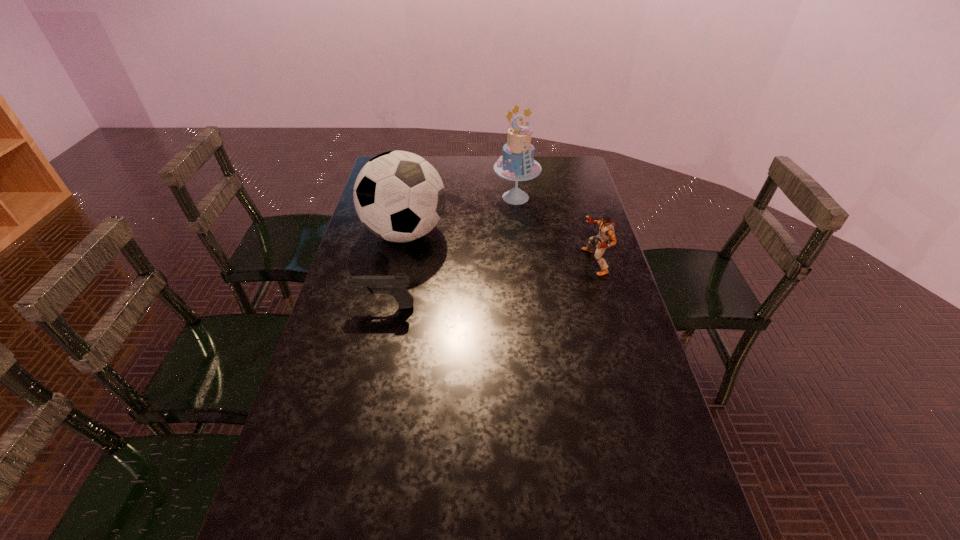
This screenshot has height=540, width=960. In order to click on vacant area located with a ladder on the side of the tallest object in this screenshot , I will do `click(515, 231)`.

Locate an element on the screen. This screenshot has height=540, width=960. blank space located 0.100m with a ladder on the side of the tallest object is located at coordinates (515, 226).

The image size is (960, 540). In order to click on free location located 0.220m with a ladder on the side of the tallest object in this screenshot , I will do (515, 246).

This screenshot has height=540, width=960. I want to click on free space located on the main logo of the soccer ball, so click(516, 309).

At what (x,y) coordinates should I click in order to perform the action: click on vacant space situated 0.280m on the main logo of the soccer ball. Please return your answer as a coordinate pair (x, y). This screenshot has height=540, width=960. Looking at the image, I should click on (492, 293).

Where is `blank area located on the main logo of the soccer ball`? blank area located on the main logo of the soccer ball is located at coordinates pos(480,285).

Locate an element on the screen. pistol that is at the left edge is located at coordinates (396, 285).

At what (x,y) coordinates should I click in order to perform the action: click on soccer ball that is at the left edge. Please return your answer as a coordinate pair (x, y). The image size is (960, 540). Looking at the image, I should click on (399, 196).

The height and width of the screenshot is (540, 960). I want to click on object that is at the right edge, so click(x=606, y=230).

At what (x,y) coordinates should I click in order to perform the action: click on vacant space at the far edge of the desktop. Please return your answer as a coordinate pair (x, y). The width and height of the screenshot is (960, 540). Looking at the image, I should click on (434, 161).